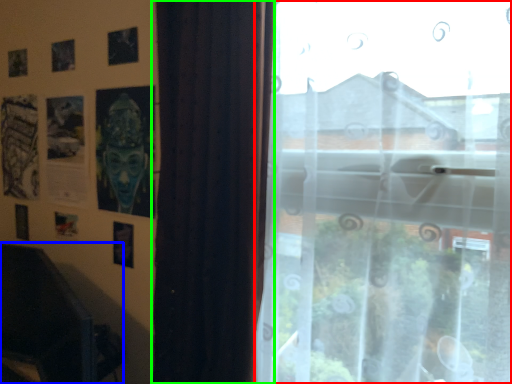
Question: Which is farther away from window (highlighted by a red box)? swivel chair (highlighted by a blue box) or curtain (highlighted by a green box)?

Choices:
 (A) swivel chair
 (B) curtain

Answer: (A)